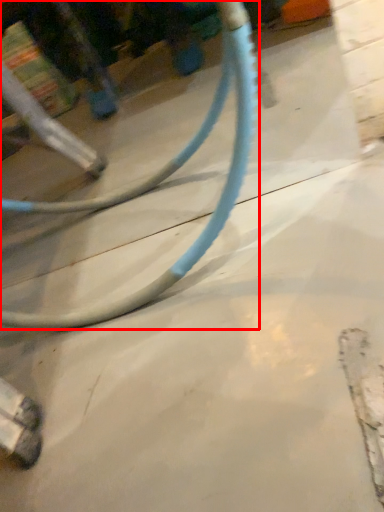
Question: In this image, where is bicycle wheel (annotated by the red box) located relative to concrete?

Choices:
 (A) right
 (B) left

Answer: (B)